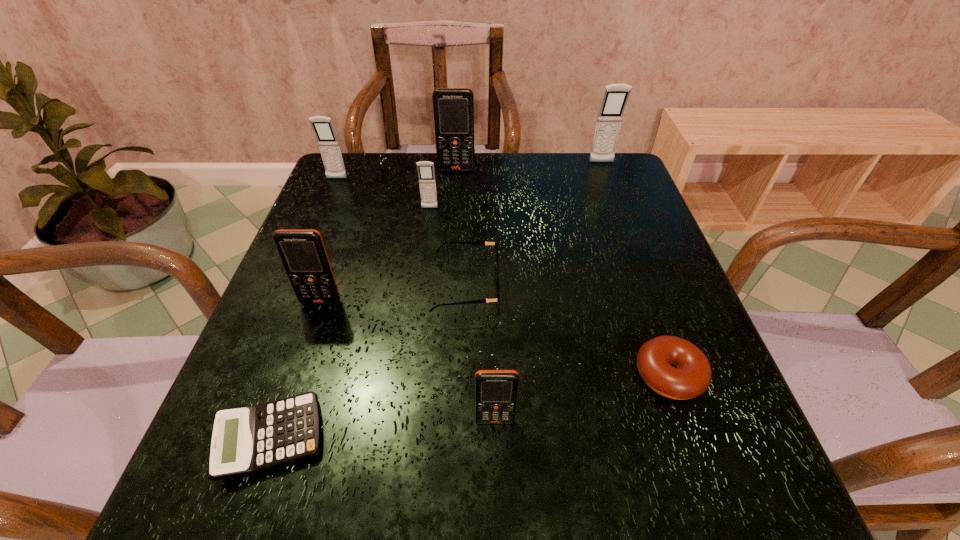
You are a GUI agent. You are given a task and a screenshot of the screen. Output one action in this format:
    pyautogui.click(x=<x>, y=<y>)
    Task: Click on the blank space located on the front-facing side of the nearest gray cellular telephone
    Image resolution: width=960 pixels, height=540 pixels.
    Given the screenshot: What is the action you would take?
    pyautogui.click(x=417, y=305)

At what (x,y) coordinates should I click in order to perform the action: click on free spot located on the front-facing side of the spectacles. Please return your answer as a coordinate pair (x, y). Looking at the image, I should click on (542, 287).

The height and width of the screenshot is (540, 960). Identify the location of vacant space positioned on the left of the doughnut. (593, 375).

Where is `blank area located on the right of the calculator`? This screenshot has width=960, height=540. blank area located on the right of the calculator is located at coordinates (358, 438).

Image resolution: width=960 pixels, height=540 pixels. I want to click on object present at the near edge, so click(246, 440).

I want to click on calculator that is positioned at the left edge, so click(x=246, y=440).

I want to click on cellular telephone at the right edge, so click(x=615, y=97).

The width and height of the screenshot is (960, 540). I want to click on doughnut positioned at the right edge, so click(x=691, y=375).

Where is `object that is at the far left corner`? The height and width of the screenshot is (540, 960). object that is at the far left corner is located at coordinates (x=329, y=146).

The image size is (960, 540). In order to click on object that is at the near left corner in this screenshot , I will do `click(246, 440)`.